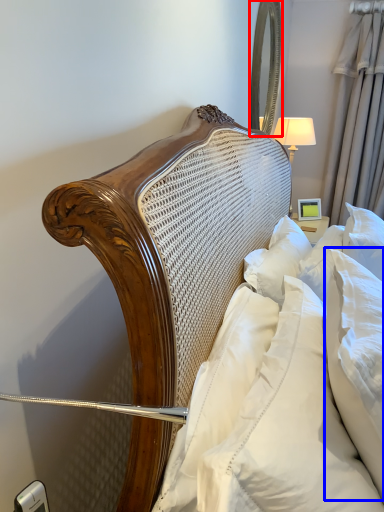
Question: Which object is closer to the camera taking this photo, mirror (highlighted by a red box) or pillow (highlighted by a blue box)?

Choices:
 (A) mirror
 (B) pillow

Answer: (B)